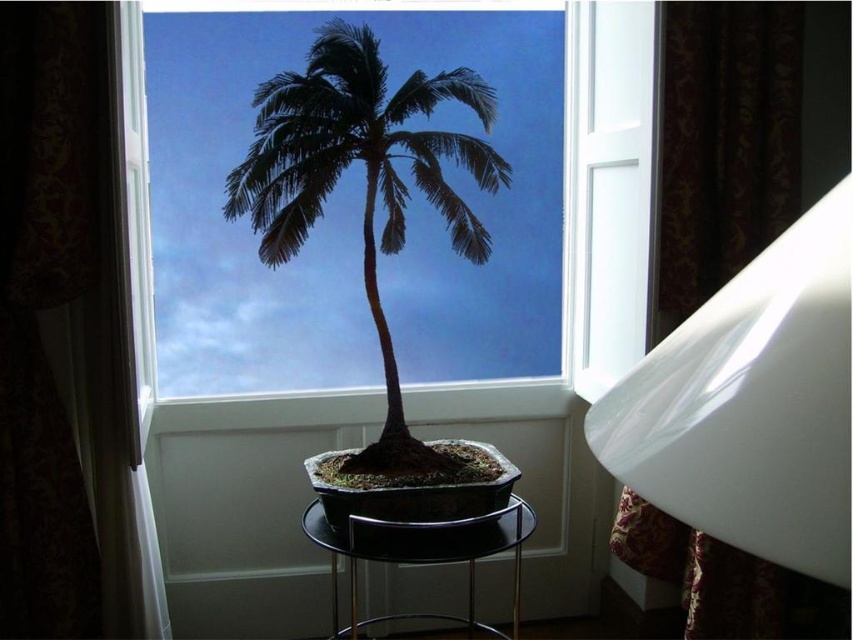
What object is located at the coordinate point [364,182] in the image?

The point [364,182] marks the location of the silky black palm tree at center.

In the scene shown: You are organizing a small event in this room and need to place a decorative item between the silky black palm tree at center and the black glass stool at center. Which object should the item be placed closer to?

The item should be placed closer to the black glass stool at center because the silky black palm tree at center is positioned on the left side of the black glass stool at center, meaning the stool is to the right of the palm tree.

You are an interior designer looking at the image. You need to place a new decorative item on the black round table near the window. The item must be placed exactly at the point marked as point [364,182]. What object is currently located at that point?

The point [364,182] indicates the location of the silky black palm tree at center, so the bonsai palm tree is currently placed there.